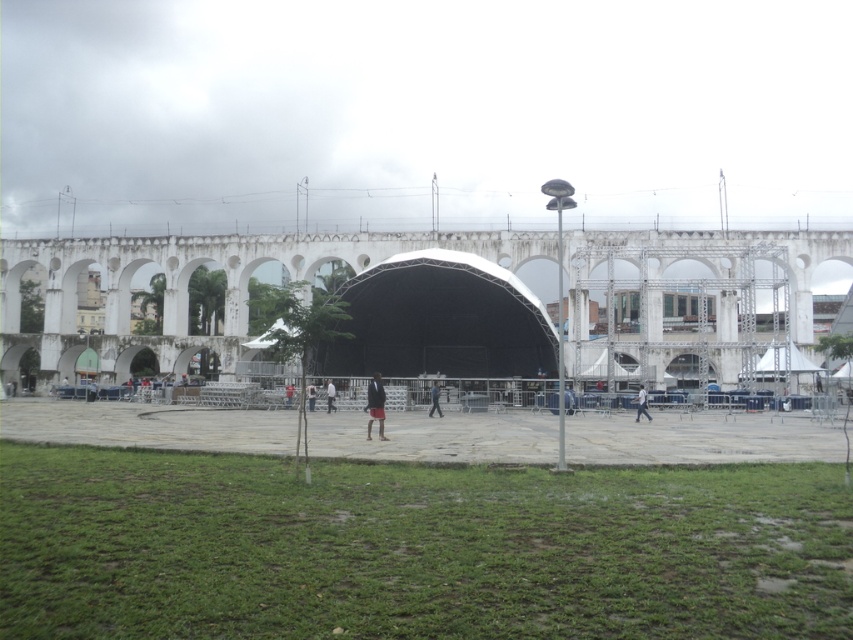
You are a photographer standing at the front of the large white dome shaped tent positioned centrally. You want to take a photo of two people wearing dark red fabric pants at center and dark blue jeans at center. How far apart should you position them in your frame to ensure both are visible clearly?

The dark red fabric pants at center and dark blue jeans at center are 10.98 meters apart. To ensure both are visible clearly in your photo, you should position them approximately 11 meters apart in your frame.

You are at an outdoor event and see two people wearing dark red fabric pants at center and dark blue jeans at center. Which one is standing to the left?

The dark red fabric pants at center are to the left of the dark blue jeans at center.